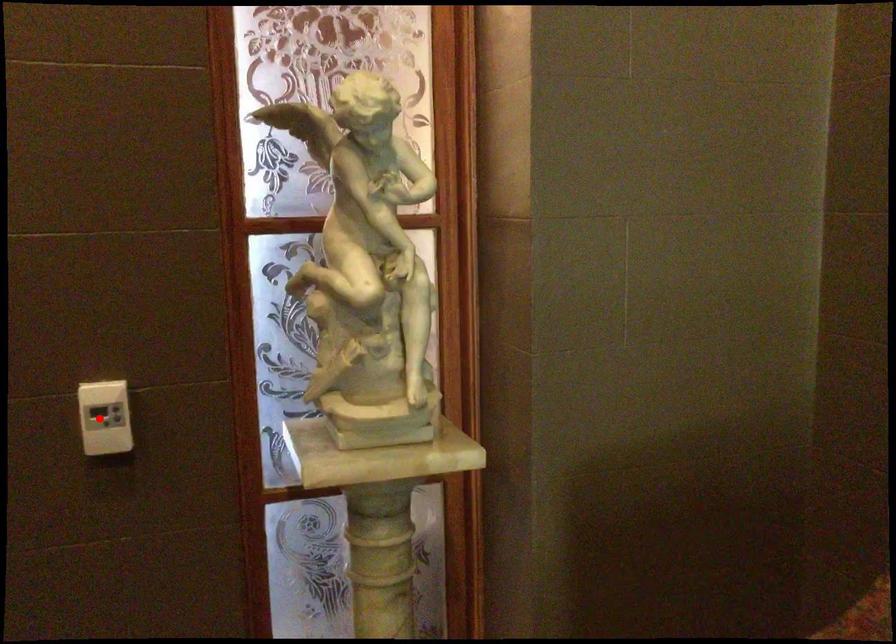
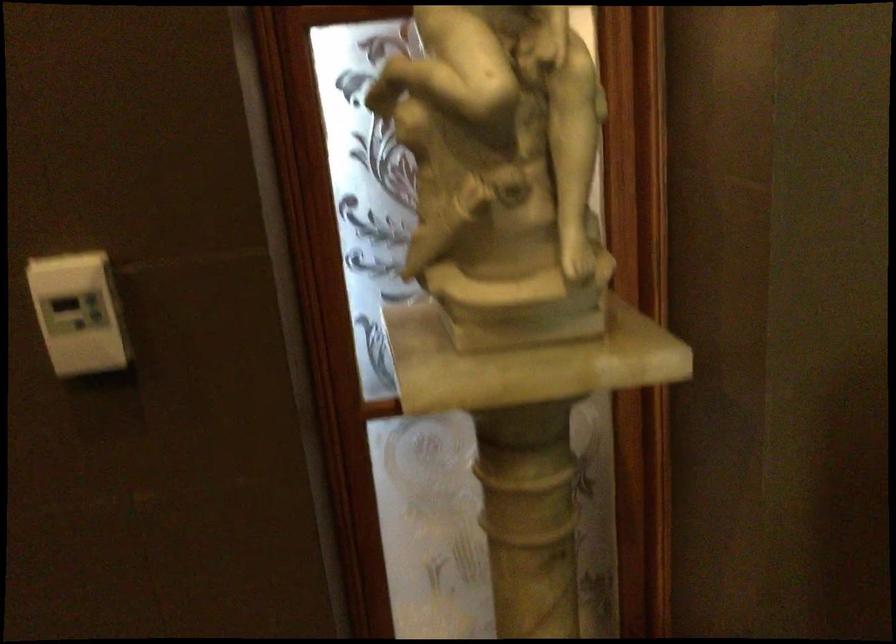
Where in the second image is the point corresponding to the highlighted location from the first image?

(79, 313)